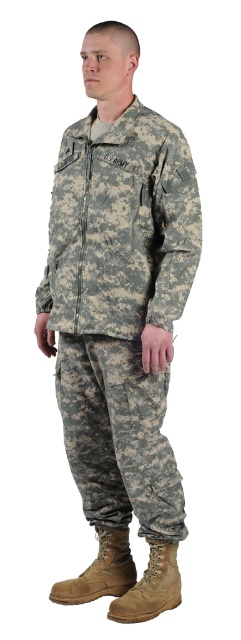
Question: Which object is positioned closest to the tan suede boot at lower center?

Choices:
 (A) tan suede boot at lower right
 (B) camouflage fabric uniform at center

Answer: (A)

Question: Among these objects, which one is farthest from the camera?

Choices:
 (A) camouflage fabric uniform at center
 (B) tan suede boot at lower right

Answer: (B)

Question: Based on their relative distances, which object is farther from the camouflage fabric uniform at center?

Choices:
 (A) tan suede boot at lower center
 (B) tan suede boot at lower right

Answer: (B)

Question: Can you confirm if tan suede boot at lower center is positioned below tan suede boot at lower right?

Choices:
 (A) yes
 (B) no

Answer: (B)

Question: Can you confirm if camouflage fabric uniform at center is positioned to the right of tan suede boot at lower center?

Choices:
 (A) yes
 (B) no

Answer: (B)

Question: In this image, where is camouflage fabric uniform at center located relative to tan suede boot at lower center?

Choices:
 (A) left
 (B) right

Answer: (A)